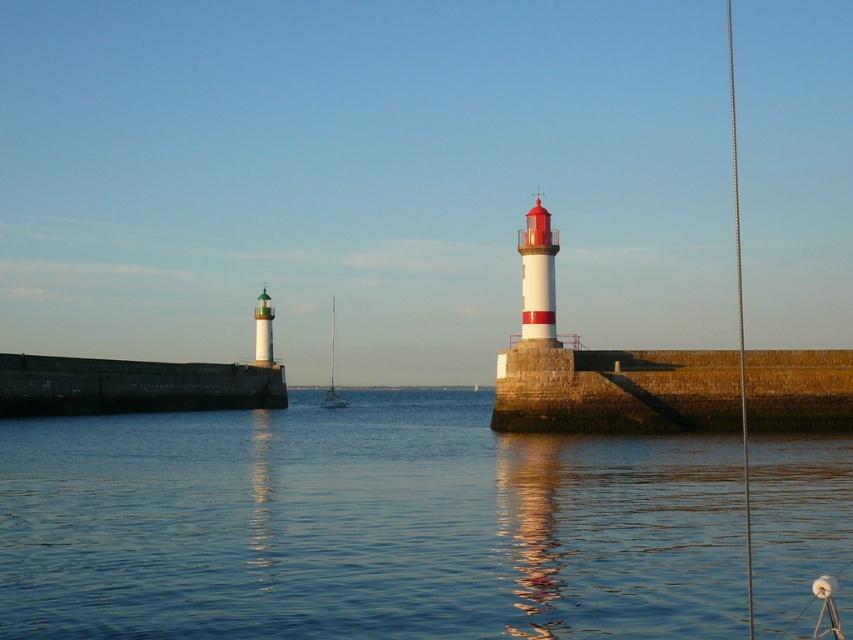
Question: Which of the following is the farthest from the observer?

Choices:
 (A) transparent water at center
 (B) white plastic sailboat at center
 (C) green glass lighthouse at left

Answer: (C)

Question: Among these objects, which one is nearest to the camera?

Choices:
 (A) transparent water at center
 (B) metallic wire at right

Answer: (A)

Question: Does transparent water at center come behind white painted metal lighthouse at center-right?

Choices:
 (A) yes
 (B) no

Answer: (B)

Question: Among these points, which one is farthest from the camera?

Choices:
 (A) (543, 339)
 (B) (746, 460)
 (C) (260, 312)

Answer: (C)

Question: Is white painted metal lighthouse at center-right positioned in front of white plastic sailboat at center?

Choices:
 (A) yes
 (B) no

Answer: (A)

Question: Can you confirm if white painted metal lighthouse at center-right is bigger than green glass lighthouse at left?

Choices:
 (A) yes
 (B) no

Answer: (B)